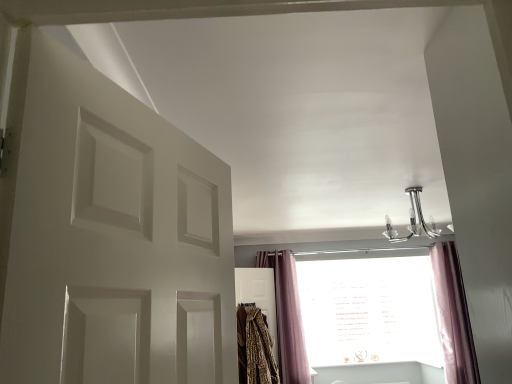
Question: Based on their sizes in the image, would you say purple velvet curtain at lower right, the 2th curtain from the right, is bigger or smaller than pink velvet curtain at lower right, which appears as the 1th curtain when viewed from the right?

Choices:
 (A) big
 (B) small

Answer: (A)

Question: In the image, is purple velvet curtain at lower right, the 2th curtain from the right, positioned in front of or behind pink velvet curtain at lower right, which appears as the 1th curtain when viewed from the right?

Choices:
 (A) behind
 (B) front

Answer: (A)

Question: Which of these objects is positioned farthest from the leopard print blanket at center?

Choices:
 (A) purple velvet curtain at lower right, positioned as the first curtain in left-to-right order
 (B) pink velvet curtain at lower right, the second curtain from the left
 (C) white matte door at left
 (D) chrome metallic chandelier at upper center

Answer: (C)

Question: Which object is the farthest from the white matte door at left?

Choices:
 (A) purple velvet curtain at lower right, positioned as the first curtain in left-to-right order
 (B) leopard print blanket at center
 (C) pink velvet curtain at lower right, which appears as the 1th curtain when viewed from the right
 (D) chrome metallic chandelier at upper center

Answer: (A)